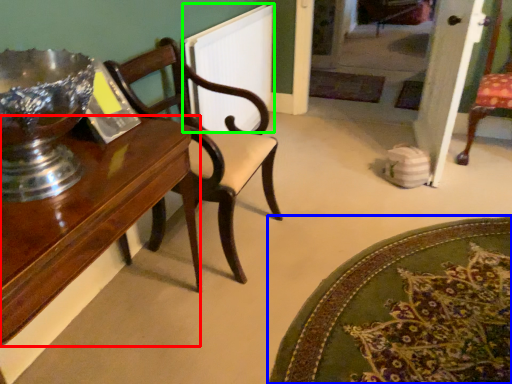
Question: Which is nearer to the table (highlighted by a red box)? mat (highlighted by a blue box) or radiator (highlighted by a green box).

Choices:
 (A) mat
 (B) radiator

Answer: (A)